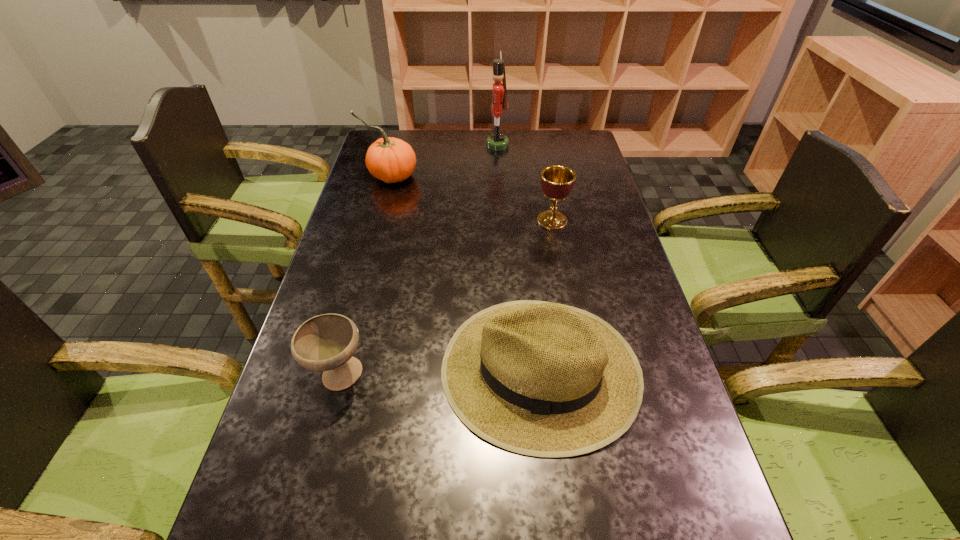
Find the location of a particular element. The width and height of the screenshot is (960, 540). the farthest object is located at coordinates (498, 141).

Identify the location of nutcracker. Image resolution: width=960 pixels, height=540 pixels. (498, 141).

You are a GUI agent. You are given a task and a screenshot of the screen. Output one action in this format:
    pyautogui.click(x=<x>, y=<y>)
    Task: Click on the second tallest object
    The width and height of the screenshot is (960, 540).
    Given the screenshot: What is the action you would take?
    pyautogui.click(x=389, y=159)

This screenshot has width=960, height=540. Find the location of `pumpkin`. pumpkin is located at coordinates (389, 159).

In order to click on the third farthest object in this screenshot , I will do `click(557, 182)`.

You are a GUI agent. You are given a task and a screenshot of the screen. Output one action in this format:
    pyautogui.click(x=<x>, y=<y>)
    Task: Click on the right chalice
    This screenshot has height=540, width=960.
    Given the screenshot: What is the action you would take?
    pyautogui.click(x=557, y=182)

At what (x,y) coordinates should I click in order to perform the action: click on sunhat. Please return your answer as a coordinate pair (x, y). The image size is (960, 540). Looking at the image, I should click on (543, 379).

The height and width of the screenshot is (540, 960). I want to click on the left chalice, so click(x=327, y=342).

The height and width of the screenshot is (540, 960). In order to click on the nearer chalice in this screenshot , I will do pos(327,342).

At what (x,y) coordinates should I click in order to perform the action: click on vacant space located on the front-facing side of the tallest object. Please return your answer as a coordinate pair (x, y). Looking at the image, I should click on (435, 145).